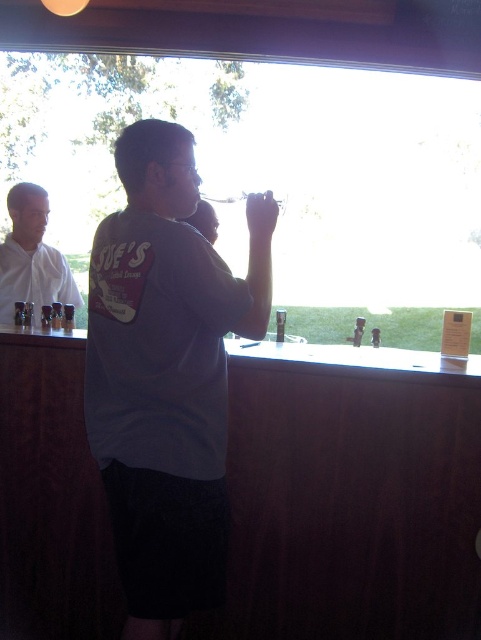
You are standing at the entrance of the winery tasting room. You see the gray cotton shirt at center. Where is it located in the image?

The gray cotton shirt at center is located at point (166, 376) in the image.

You are a wine taster standing at the counter and need to hand your wine glass to the person wearing the gray cotton shirt at center. Can you reach them without moving your feet?

Result: The gray cotton shirt at center and viewer are 1.30 meters apart from each other. The average human arm span is about 1.5 meters, so yes, you can reach them without moving your feet.

Looking at this image, you are a photographer at the winery event and need to capture both the gray cotton shirt at center and the white matte shirt at left in a single shot. Based on their positions, which shirt should you focus on first to ensure both are in frame?

The gray cotton shirt at center is in front of the white matte shirt at left, so focusing on the gray cotton shirt at center first will ensure both are in frame as the white matte shirt at left is behind it.